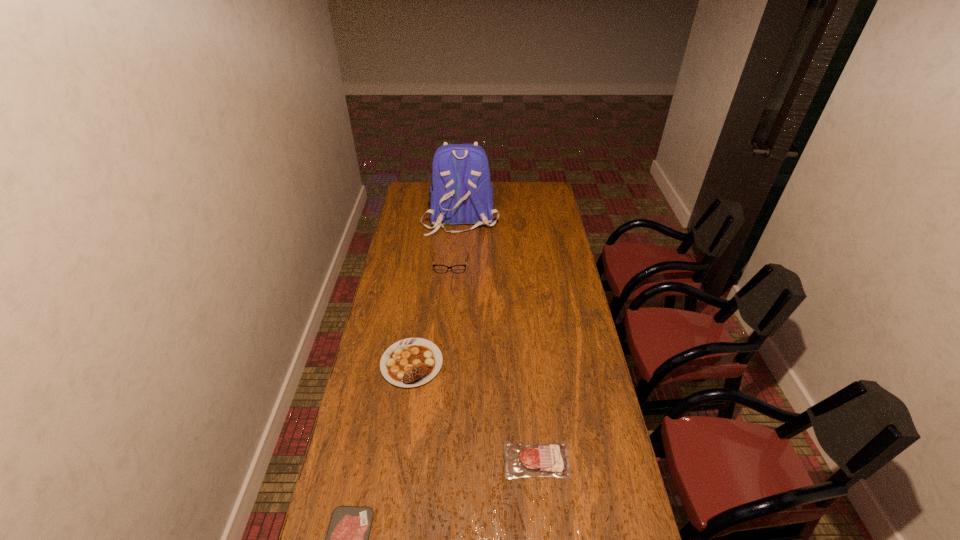
Where is `vacant space located 0.160m on the front of the second nearest steak`? The image size is (960, 540). vacant space located 0.160m on the front of the second nearest steak is located at coordinates (544, 536).

At what (x,y) coordinates should I click in order to perform the action: click on object at the far edge. Please return your answer as a coordinate pair (x, y). The height and width of the screenshot is (540, 960). Looking at the image, I should click on (462, 193).

The width and height of the screenshot is (960, 540). I want to click on backpack positioned at the left edge, so click(x=462, y=193).

In order to click on steak that is at the left edge in this screenshot , I will do `click(411, 362)`.

Identify the location of object that is at the right edge. Image resolution: width=960 pixels, height=540 pixels. (551, 459).

The image size is (960, 540). Find the location of `object at the far left corner`. object at the far left corner is located at coordinates tap(462, 193).

Where is `vacant area at the far edge of the desktop`? vacant area at the far edge of the desktop is located at coordinates (501, 183).

Identify the location of free space at the left edge of the desktop. This screenshot has height=540, width=960. (361, 423).

In the image, there is a desktop. Identify the location of vacant space at the right edge. (578, 307).

In the image, there is a desktop. Where is `vacant space at the far left corner`? vacant space at the far left corner is located at coordinates (430, 190).